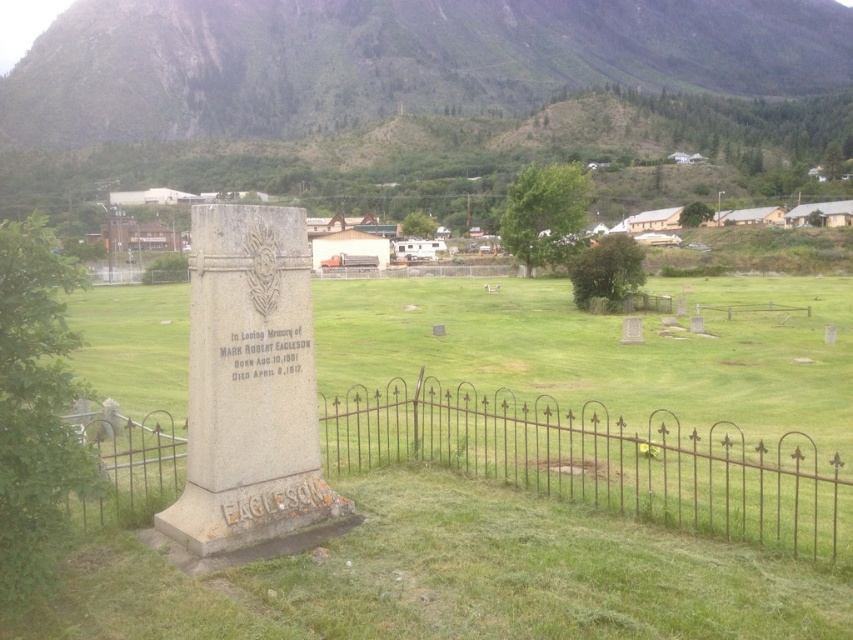
Question: In this image, where is green grassy at center located relative to green grassy hill at upper center?

Choices:
 (A) left
 (B) right

Answer: (B)

Question: Can you confirm if green grassy hill at upper center is positioned below rusty metal fence at center?

Choices:
 (A) no
 (B) yes

Answer: (A)

Question: Which of the following is the farthest from the observer?

Choices:
 (A) (22, 76)
 (B) (225, 506)

Answer: (A)

Question: Estimate the real-world distances between objects in this image. Which object is farther from the green grassy hill at upper center?

Choices:
 (A) rusty metal fence at center
 (B) green grassy at center

Answer: (A)

Question: Which point appears farthest from the camera in this image?

Choices:
 (A) (569, 464)
 (B) (432, 573)

Answer: (A)

Question: Does green grassy hill at upper center appear under rusty metal fence at center?

Choices:
 (A) no
 (B) yes

Answer: (A)